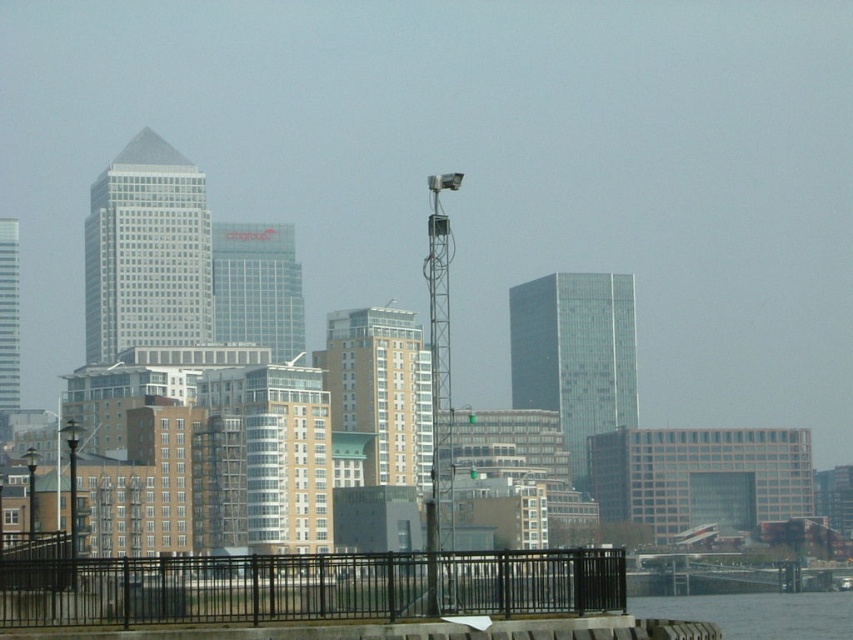
Is black metal fence at lower center closer to camera compared to matte glass skyscraper at upper left?

Yes, black metal fence at lower center is in front of matte glass skyscraper at upper left.

Measure the distance between black metal fence at lower center and matte glass skyscraper at upper left.

black metal fence at lower center and matte glass skyscraper at upper left are 353.53 meters apart.

Is point (248, 596) positioned before point (16, 362)?

Yes, point (248, 596) is closer to viewer.

This screenshot has height=640, width=853. I want to click on black metal fence at lower center, so click(308, 588).

Can you confirm if matte glass skyscraper at center is thinner than matte glass skyscraper at upper left?

Incorrect, matte glass skyscraper at center's width is not less than matte glass skyscraper at upper left's.

Is matte glass skyscraper at center wider than matte glass skyscraper at upper left?

Correct, the width of matte glass skyscraper at center exceeds that of matte glass skyscraper at upper left.

Who is more forward, (120, 161) or (7, 408)?

Point (7, 408)

Image resolution: width=853 pixels, height=640 pixels. Find the location of `matte glass skyscraper at center`. matte glass skyscraper at center is located at coordinates (146, 252).

Between black metal fence at lower center and white glass building at center, which one appears on the left side from the viewer's perspective?

white glass building at center

Who is lower down, black metal fence at lower center or white glass building at center?

white glass building at center is below.

Is point (142, 580) positioned in front of point (404, 323)?

Yes, it is.

The width and height of the screenshot is (853, 640). What are the coordinates of `black metal fence at lower center` in the screenshot? It's located at (308, 588).